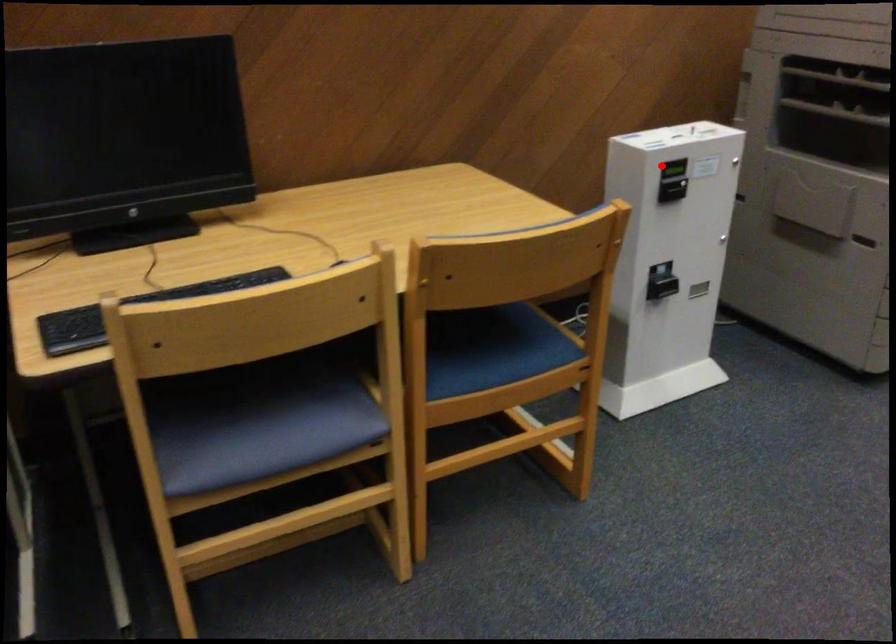
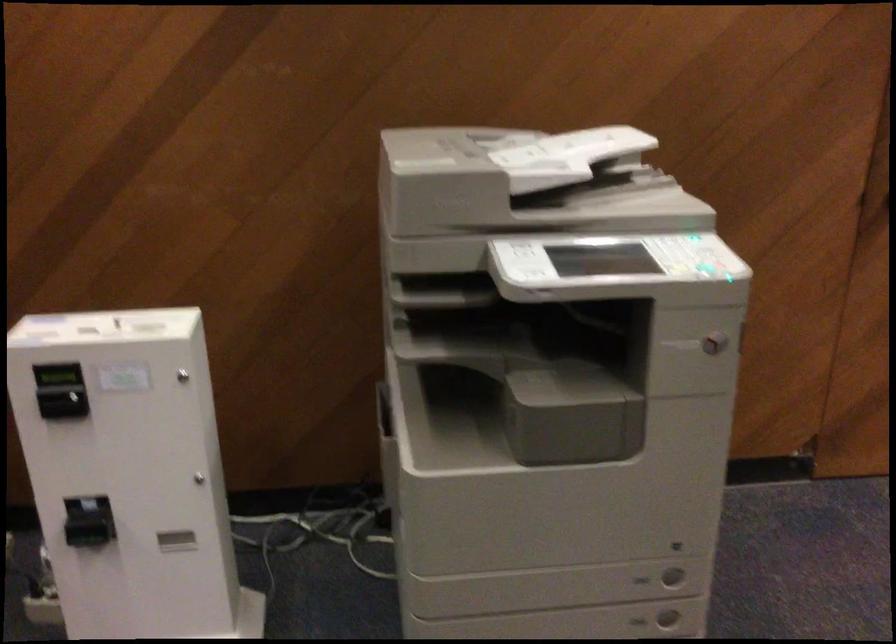
In the second image, find the point that corresponds to the highlighted location in the first image.

(56, 375)